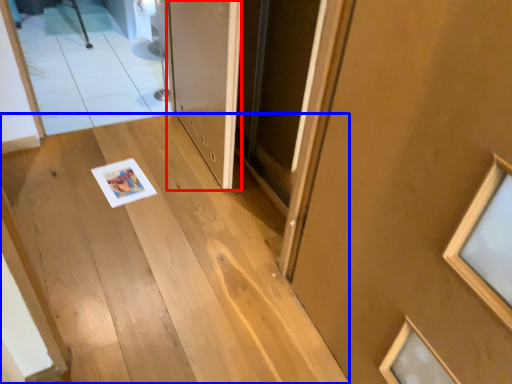
Question: Which point is further to the camera, door (highlighted by a red box) or stairs (highlighted by a blue box)?

Choices:
 (A) door
 (B) stairs

Answer: (A)